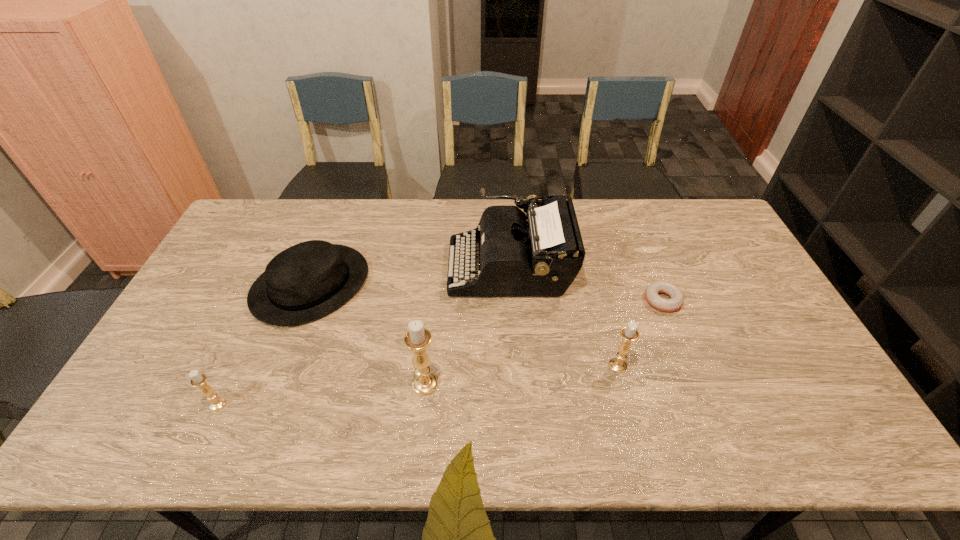
The candle holders are evenly distributed in the image. To maintain this, where would you place another candle holder on the right? Please point to a free space. Please provide its 2D coordinates. Your answer should be formatted as a tuple, i.e. [(x, y)], where the tuple contains the x and y coordinates of a point satisfying the conditions above.

[(799, 348)]